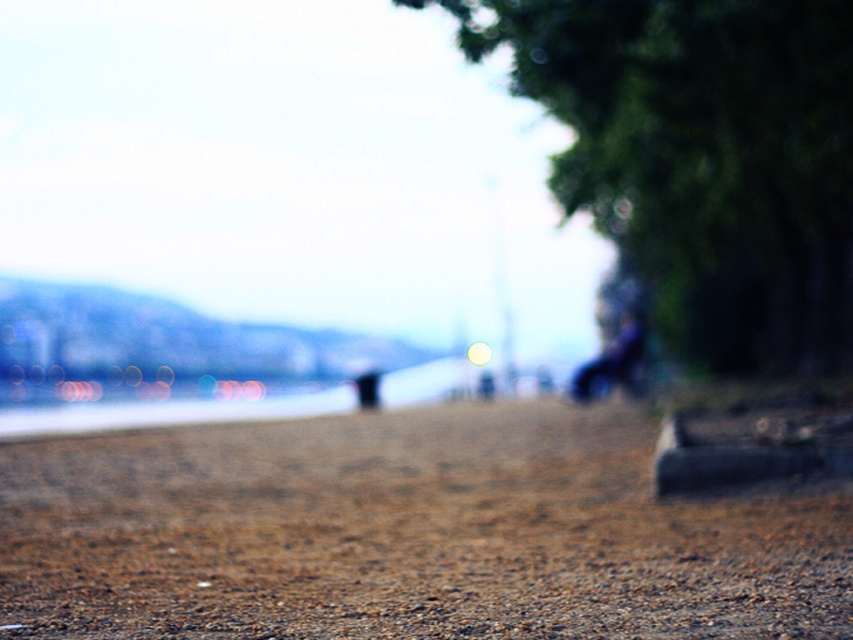
Question: Which point is farther to the camera?

Choices:
 (A) dark blue fabric at right
 (B) green leafy tree at upper right

Answer: (A)

Question: Can you confirm if green leafy tree at upper right is smaller than dark blue fabric at right?

Choices:
 (A) yes
 (B) no

Answer: (B)

Question: Can you confirm if green leafy tree at upper right is positioned to the right of dark blue fabric at right?

Choices:
 (A) no
 (B) yes

Answer: (B)

Question: Can you confirm if green leafy tree at upper right is wider than dark blue fabric at right?

Choices:
 (A) yes
 (B) no

Answer: (A)